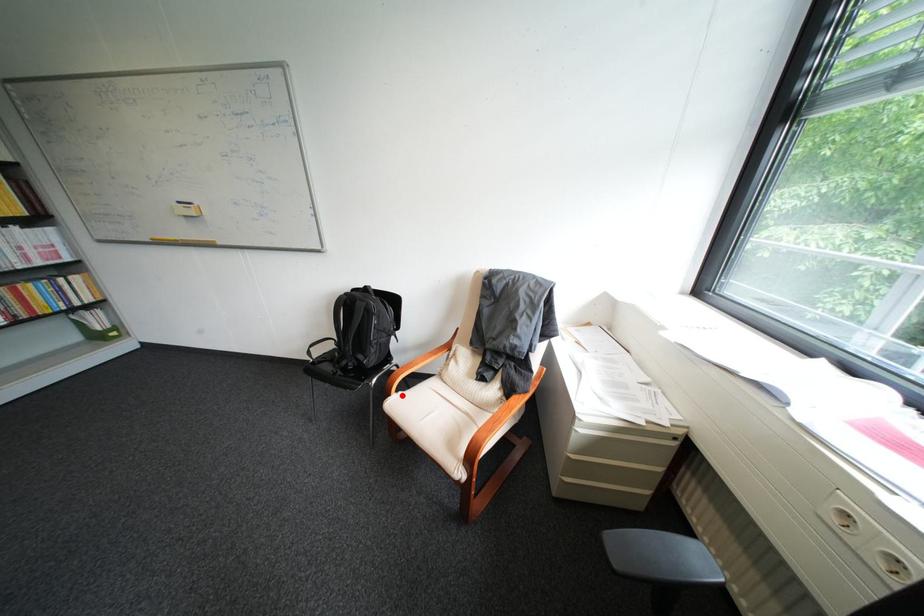
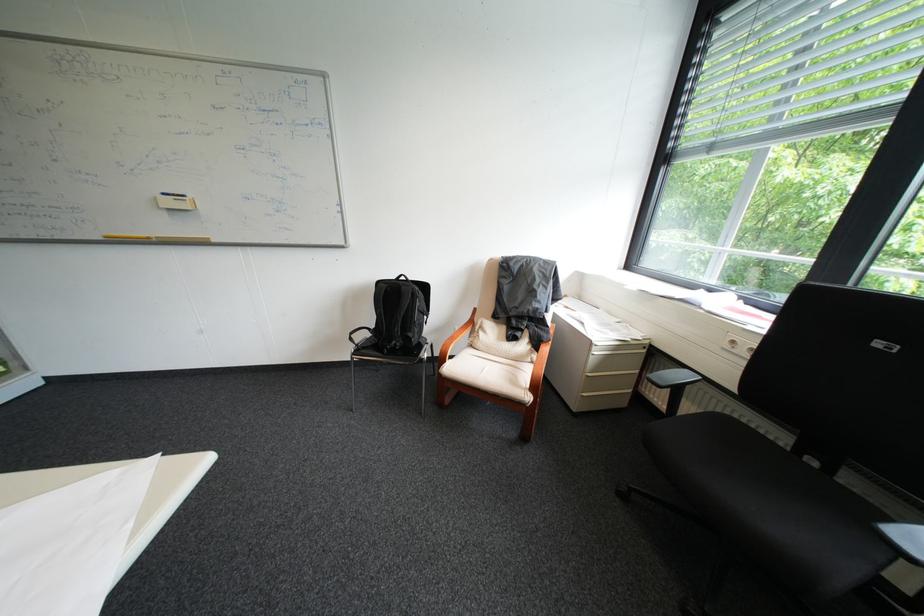
Question: I am providing you with two images of the same scene from different viewpoints. In image1, a red point is highlighted. Considering the same 3D point in image2, which of the following is correct?

Choices:
 (A) It is closer
 (B) It is farther

Answer: (A)